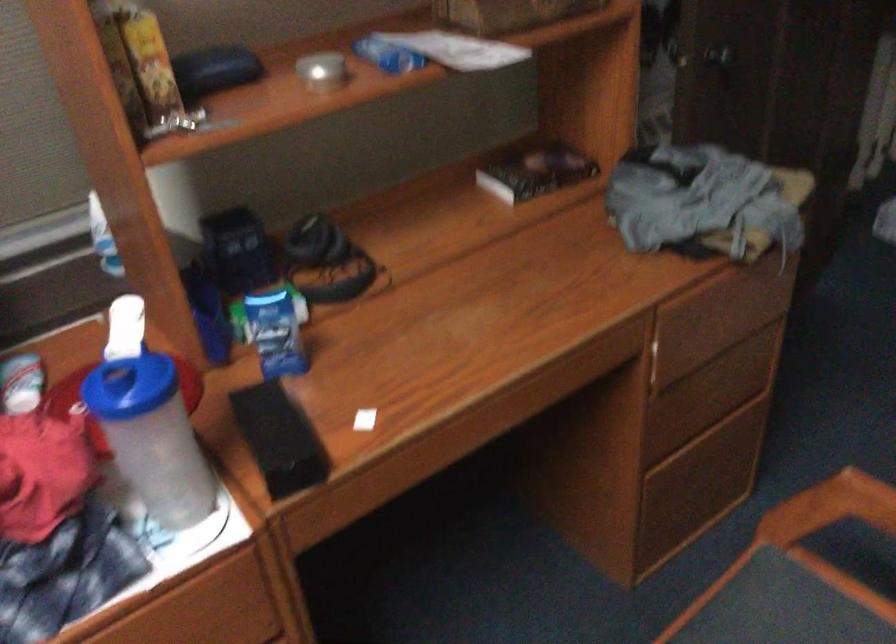
This screenshot has height=644, width=896. Describe the element at coordinates (830, 507) in the screenshot. I see `a wooden chair armrest` at that location.